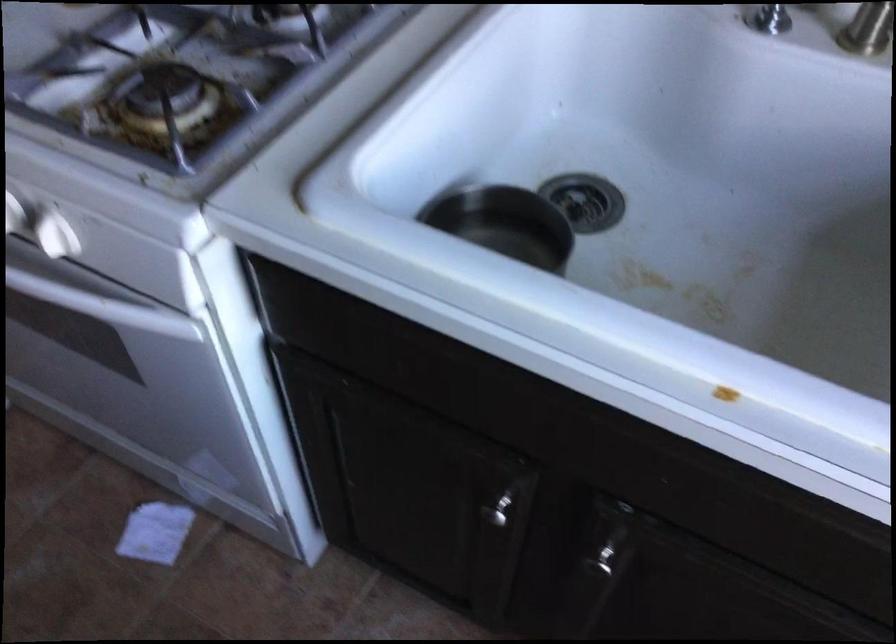
Find where to lift the metal bowl. Please return your answer as a coordinate pair (x, y).

(504, 223)